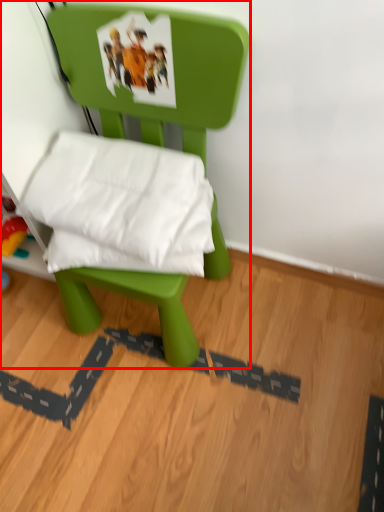
Question: From the image's perspective, where is furniture (annotated by the red box) located in relation to pillow in the image?

Choices:
 (A) below
 (B) above

Answer: (A)